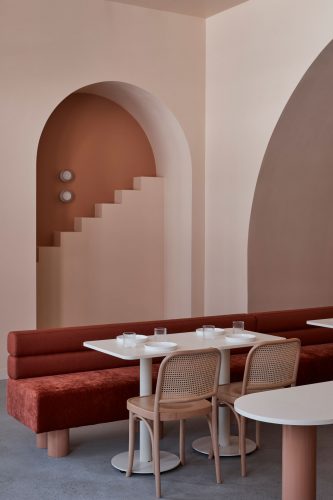
This screenshot has height=500, width=333. Find the location of `table`. table is located at coordinates (129, 355).